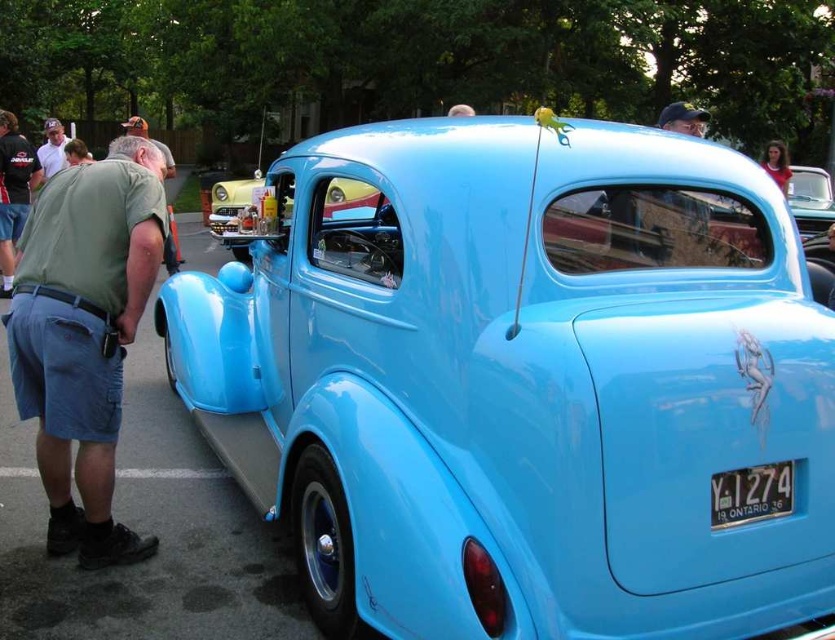
You are at a car show and see the vintage car. You notice two objects on the car roof. One is a matte black cap at upper center and the other is smooth skin at upper right. Which object is closer to you?

The matte black cap at upper center is closer to you because the smooth skin at upper right is behind it.

You are a photographer at the car show and want to take a photo of the vintage car. You notice the matte black cap at upper center and the smooth skin at upper right. Which of these two objects has a narrower width?

The matte black cap at upper center has a lesser width compared to the smooth skin at upper right, so the matte black cap at upper center is narrower.